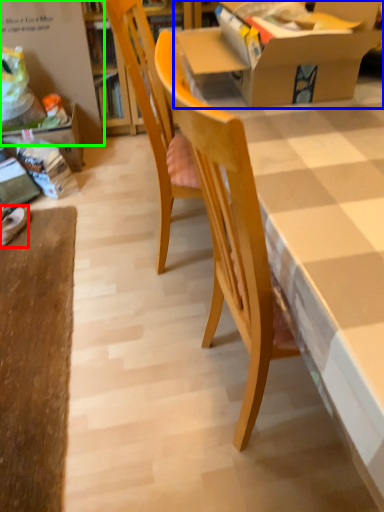
Question: Which object is the closest to the footwear (highlighted by a red box)? Choose among these: box (highlighted by a blue box) or bulletin board (highlighted by a green box).

Choices:
 (A) box
 (B) bulletin board

Answer: (B)